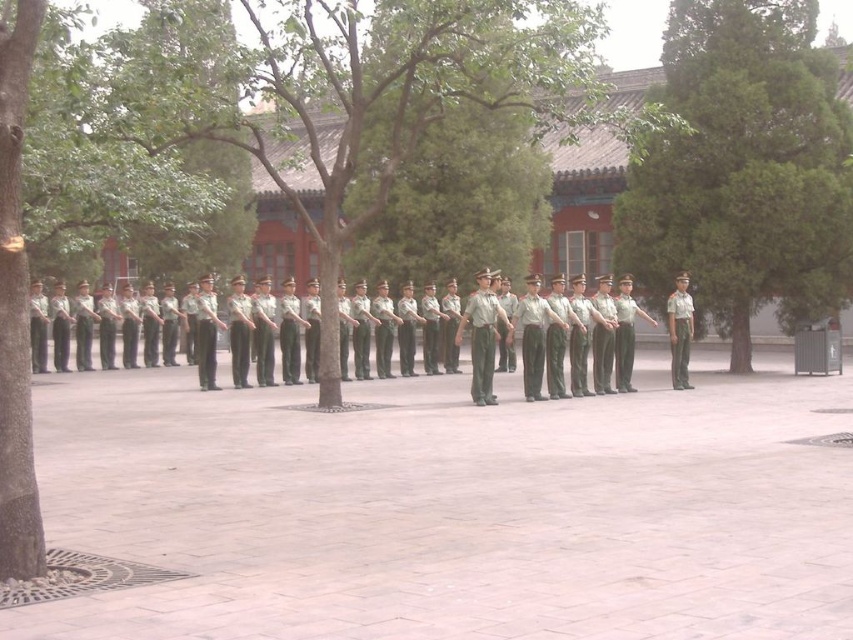
Question: Observing the image, what is the correct spatial positioning of green textured tree at center in reference to light gray fabric uniform at center?

Choices:
 (A) right
 (B) left

Answer: (A)

Question: Considering the relative positions of green textured tree at center and green leafy tree at left in the image provided, where is green textured tree at center located with respect to green leafy tree at left?

Choices:
 (A) right
 (B) left

Answer: (A)

Question: Which object is farther from the camera taking this photo?

Choices:
 (A) green textured tree at center
 (B) light gray uniform at center
 (C) light gray fabric uniform at center
 (D) green leafy tree at left

Answer: (A)

Question: Which point is farther to the camera?

Choices:
 (A) light gray fabric uniform at center
 (B) light gray uniform at center

Answer: (A)

Question: Is light gray uniform at center wider than light gray fabric uniform at center?

Choices:
 (A) yes
 (B) no

Answer: (A)

Question: Which point is farther to the camera?

Choices:
 (A) green leafy tree at left
 (B) green uniform at center
 (C) green textured tree at center
 (D) light gray uniform at center

Answer: (C)